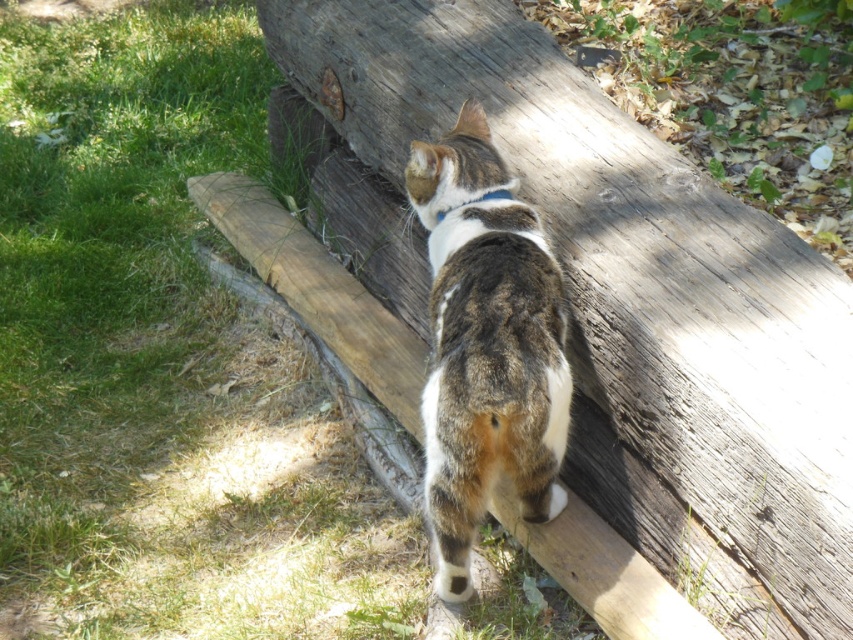
Question: Can you confirm if weathered wood at center is bigger than tabby fur cat at center?

Choices:
 (A) yes
 (B) no

Answer: (A)

Question: Is weathered wood at center positioned before tabby fur cat at center?

Choices:
 (A) yes
 (B) no

Answer: (A)

Question: Does weathered wood at center appear on the right side of tabby fur cat at center?

Choices:
 (A) yes
 (B) no

Answer: (B)

Question: Which object is closer to the camera taking this photo?

Choices:
 (A) tabby fur cat at center
 (B) weathered wood at center

Answer: (B)

Question: Which of the following is the farthest from the observer?

Choices:
 (A) (724, 193)
 (B) (494, 413)

Answer: (A)

Question: Which point is farther to the camera?

Choices:
 (A) tabby fur cat at center
 (B) weathered wood at center

Answer: (A)